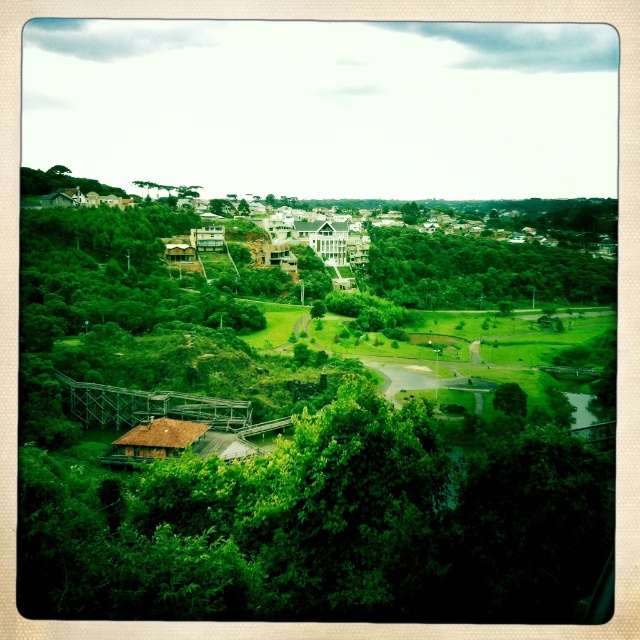
Question: Which point appears closest to the camera in this image?

Choices:
 (A) (522, 282)
 (B) (481, 513)

Answer: (B)

Question: Which object is positioned farthest from the green leafy tree at center?

Choices:
 (A) green grassy field at center
 (B) green leafy trees at center-right
 (C) green leafy tree at upper left

Answer: (C)

Question: Is green leafy tree at center thinner than green grassy field at center?

Choices:
 (A) yes
 (B) no

Answer: (B)

Question: Can you confirm if green leafy tree at center is positioned to the right of green grassy field at center?

Choices:
 (A) yes
 (B) no

Answer: (B)

Question: Which is nearer to the green leafy tree at upper left?

Choices:
 (A) green leafy tree at center
 (B) green grassy field at center

Answer: (A)

Question: Does green leafy tree at center have a smaller size compared to green grassy field at center?

Choices:
 (A) yes
 (B) no

Answer: (B)